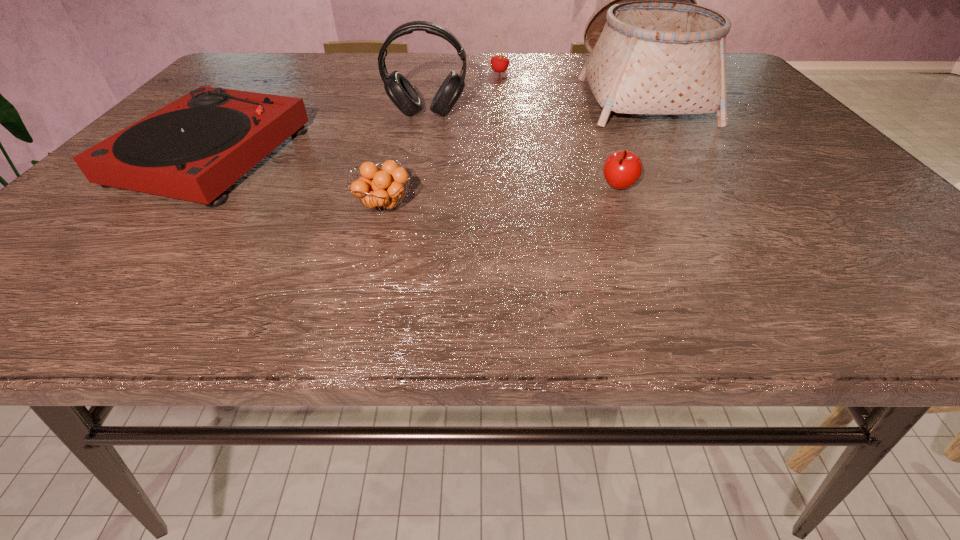
Identify the location of vacant area that lies between the farther cherry and the headset. The height and width of the screenshot is (540, 960). (464, 93).

The height and width of the screenshot is (540, 960). Identify the location of free space between the orange fruit and the third object from right to left. (442, 139).

Where is `vacant area that lies between the headset and the nearer cherry`? This screenshot has height=540, width=960. vacant area that lies between the headset and the nearer cherry is located at coordinates (523, 151).

Where is `vacant area that lies between the basket and the headset`? The height and width of the screenshot is (540, 960). vacant area that lies between the basket and the headset is located at coordinates (533, 103).

Find the location of a particular element. unoccupied area between the left cherry and the fifth shortest object is located at coordinates (464, 93).

The height and width of the screenshot is (540, 960). In order to click on the second closest object relative to the right cherry in this screenshot , I will do `click(380, 189)`.

Identify which object is located as the fifth nearest to the basket. Please provide its 2D coordinates. Your answer should be formatted as a tuple, i.e. [(x, y)], where the tuple contains the x and y coordinates of a point satisfying the conditions above.

[(195, 148)]

The height and width of the screenshot is (540, 960). Find the location of `free space that satisfies the following two spatial constraints: 1. on the back side of the orange fruit; 2. on the left side of the farther cherry`. free space that satisfies the following two spatial constraints: 1. on the back side of the orange fruit; 2. on the left side of the farther cherry is located at coordinates (419, 72).

Locate an element on the screen. The image size is (960, 540). free region that satisfies the following two spatial constraints: 1. on the earcups of the nearer cherry; 2. on the right side of the headset is located at coordinates (413, 188).

Where is `vacant space that satisfies the following two spatial constraints: 1. with the lid open on the basket; 2. on the earcups of the headset`? The height and width of the screenshot is (540, 960). vacant space that satisfies the following two spatial constraints: 1. with the lid open on the basket; 2. on the earcups of the headset is located at coordinates (653, 114).